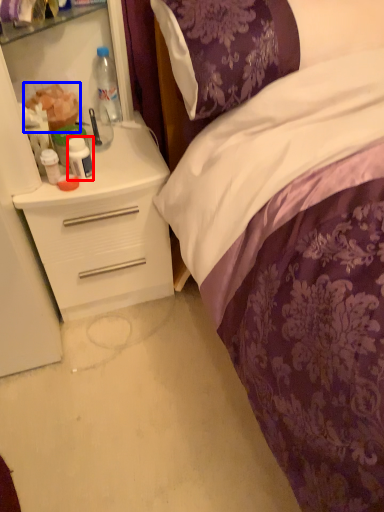
Question: Which object is further to the camera taking this photo, bottle (highlighted by a red box) or food (highlighted by a blue box)?

Choices:
 (A) bottle
 (B) food

Answer: (B)